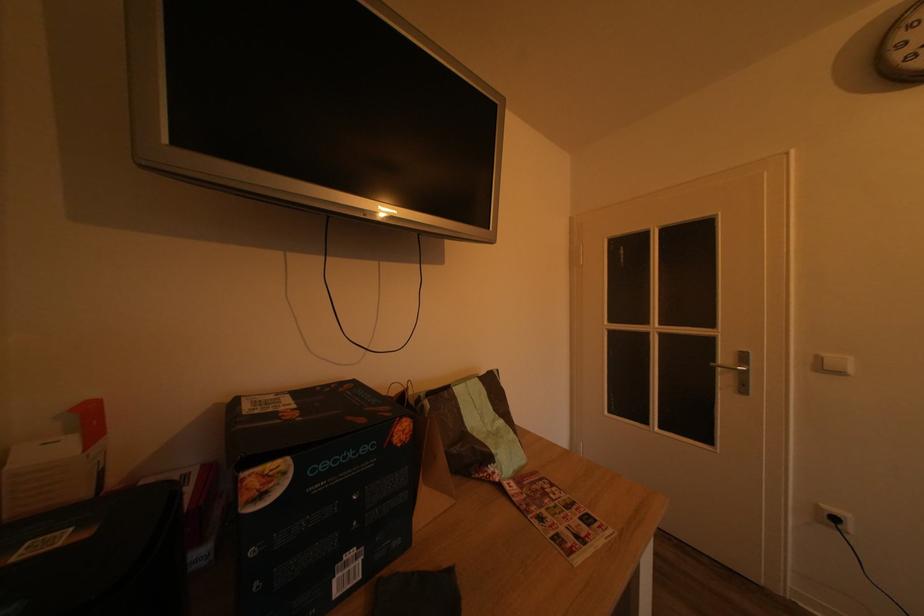
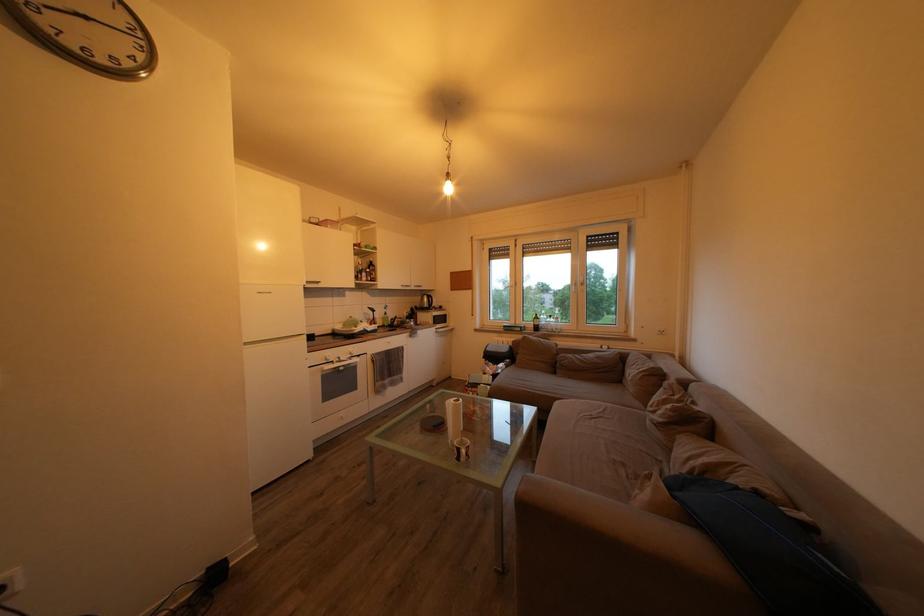
Question: The first image is from the beginning of the video and the second image is from the end. How did the camera likely rotate when shooting the video?

Choices:
 (A) Left
 (B) Right
 (C) Up
 (D) Down

Answer: (B)